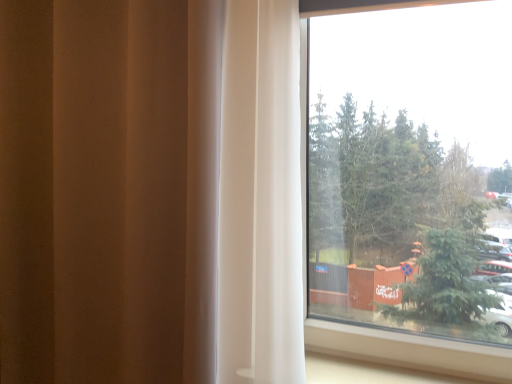
Question: In terms of size, does transparent glass window at upper right appear bigger or smaller than white sheer curtain at right?

Choices:
 (A) small
 (B) big

Answer: (A)

Question: Relative to white sheer curtain at right, is transparent glass window at upper right in front or behind?

Choices:
 (A) behind
 (B) front

Answer: (A)

Question: Is point (372, 231) closer or farther from the camera than point (35, 327)?

Choices:
 (A) closer
 (B) farther

Answer: (A)

Question: In terms of height, does white sheer curtain at right look taller or shorter compared to transparent glass window at upper right?

Choices:
 (A) tall
 (B) short

Answer: (A)

Question: From a real-world perspective, is white sheer curtain at right physically located above or below transparent glass window at upper right?

Choices:
 (A) below
 (B) above

Answer: (A)

Question: Is point (186, 182) closer or farther from the camera than point (376, 342)?

Choices:
 (A) closer
 (B) farther

Answer: (A)

Question: In the image, is white sheer curtain at right positioned in front of or behind transparent glass window at upper right?

Choices:
 (A) front
 (B) behind

Answer: (A)